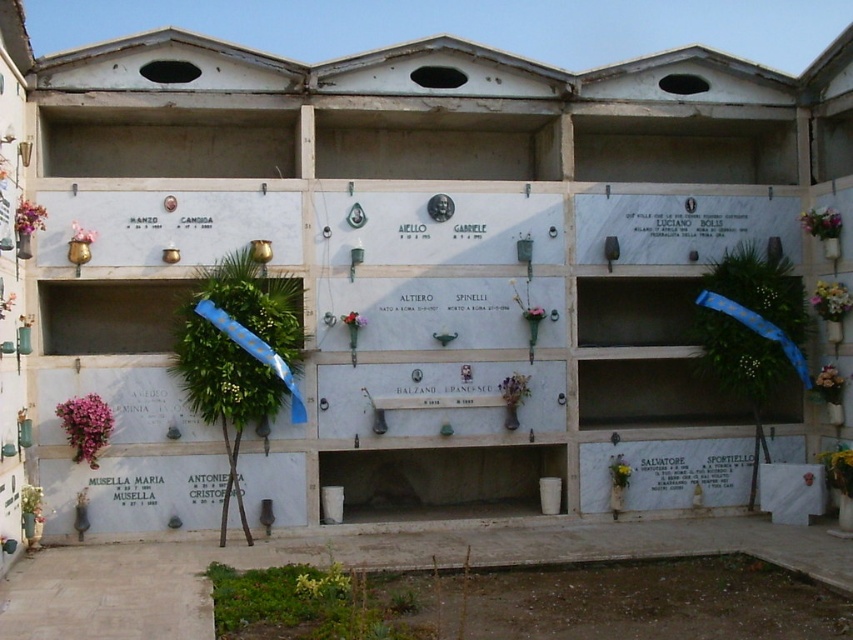
Who is more forward, (287, 390) or (341, 321)?

Positioned in front is point (287, 390).

Who is lower down, green leafy wreath at center or pink silk flower at center?

Positioned lower is green leafy wreath at center.

Describe the element at coordinates (239, 355) in the screenshot. This screenshot has width=853, height=640. I see `green leafy wreath at center` at that location.

You are a GUI agent. You are given a task and a screenshot of the screen. Output one action in this format:
    pyautogui.click(x=<x>, y=<y>)
    Task: Click on the green leafy wreath at center
    The image size is (853, 640).
    Given the screenshot: What is the action you would take?
    pyautogui.click(x=239, y=355)

Who is higher up, green leafy wreath at right or pink fabric flower at center?

green leafy wreath at right is higher up.

Which of these two, green leafy wreath at right or pink fabric flower at center, stands shorter?

pink fabric flower at center

At what (x,y) coordinates should I click in order to perform the action: click on green leafy wreath at right. Please return your answer as a coordinate pair (x, y). Looking at the image, I should click on (751, 321).

Can you confirm if green leafy wreath at center is shorter than pink fabric flower at lower right?

No.

Who is taller, green leafy wreath at center or pink fabric flower at lower right?

green leafy wreath at center

In order to click on green leafy wreath at center in this screenshot , I will do `click(239, 355)`.